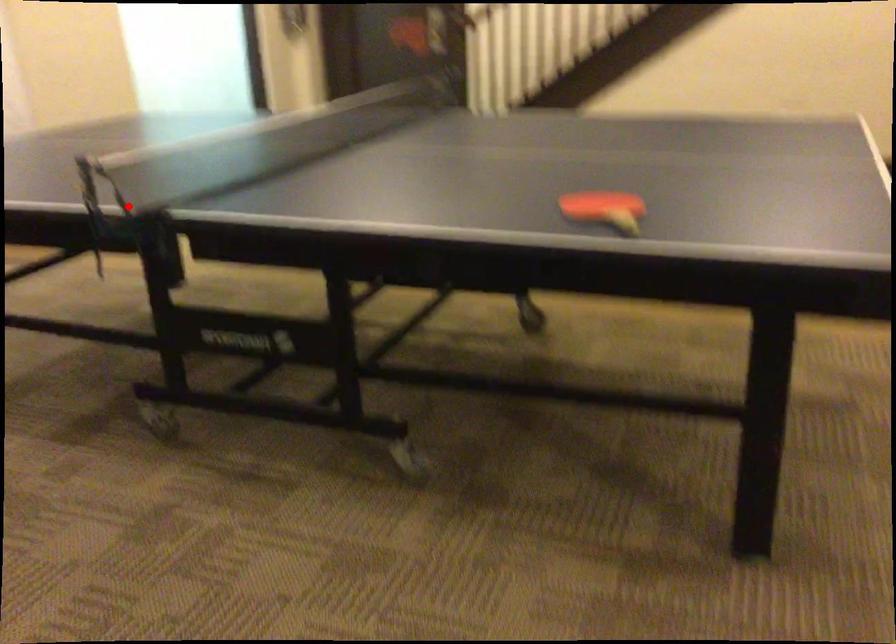
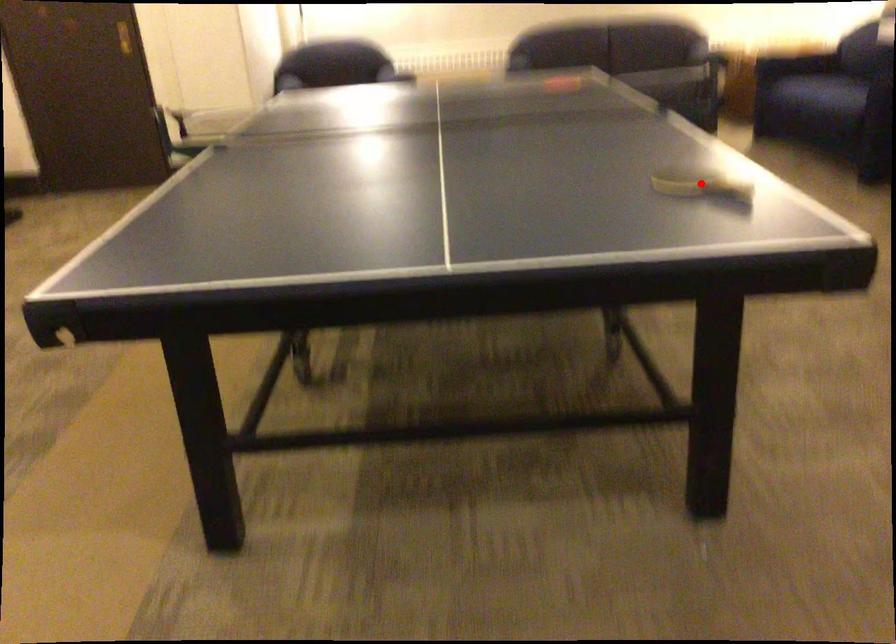
I am providing you with two images of the same scene from different viewpoints. A red point is marked on the first image and another point is marked on the second image. Are the points marked in image1 and image2 representing the same 3D position?

No